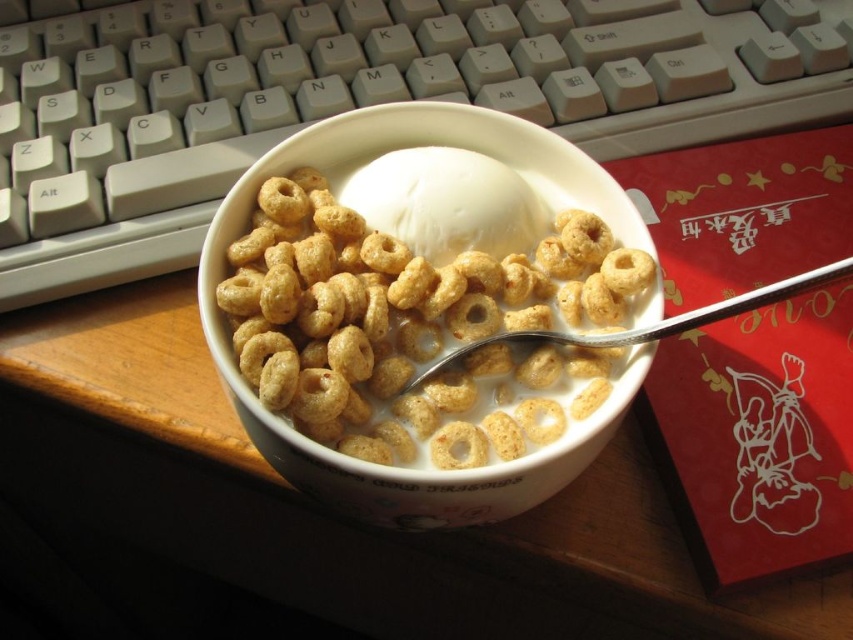
Between golden matte cereal at center and satin silver spoon at center, which one has less height?

satin silver spoon at center is shorter.

Does point (364, 228) lie in front of point (817, 275)?

No, it is not.

Who is more forward, (462, 288) or (727, 300)?

Point (462, 288) is in front.

Image resolution: width=853 pixels, height=640 pixels. In order to click on golden matte cereal at center in this screenshot , I will do `click(416, 330)`.

Can you confirm if white plastic keyboard at upper center is positioned above satin silver spoon at center?

Yes.

Does white plastic keyboard at upper center have a larger size compared to satin silver spoon at center?

Yes, white plastic keyboard at upper center is bigger than satin silver spoon at center.

Measure the distance between white plastic keyboard at upper center and camera.

white plastic keyboard at upper center is 90.78 centimeters from camera.

You are a GUI agent. You are given a task and a screenshot of the screen. Output one action in this format:
    pyautogui.click(x=<x>, y=<y>)
    Task: Click on the white plastic keyboard at upper center
    The image size is (853, 640).
    Given the screenshot: What is the action you would take?
    click(357, 100)

Can you confirm if golden matte cereal at center is positioned to the left of white creamy ice cream at center?

Yes, golden matte cereal at center is to the left of white creamy ice cream at center.

Can you confirm if golden matte cereal at center is positioned to the right of white creamy ice cream at center?

No, golden matte cereal at center is not to the right of white creamy ice cream at center.

Is point (408, 380) positioned in front of point (413, 160)?

Yes.

Find the location of a particular element. The width and height of the screenshot is (853, 640). golden matte cereal at center is located at coordinates (416, 330).